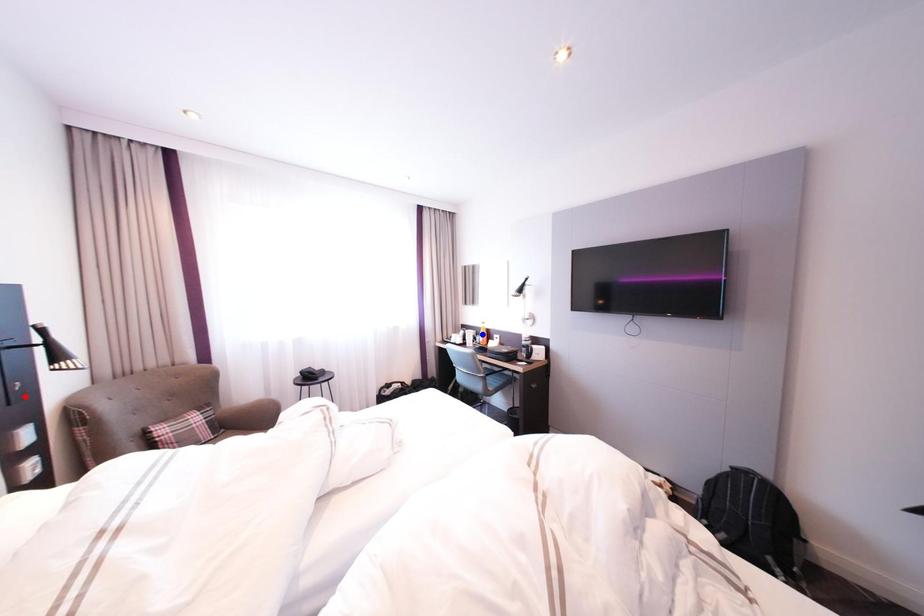
Question: Two points are marked on the image. Which point is closer to the camera?

Choices:
 (A) Blue point is closer.
 (B) Red point is closer.

Answer: (B)